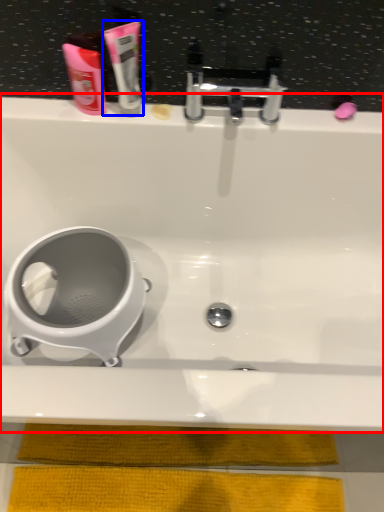
Question: Which of the following is the closest to the observer, bathtub (highlighted by a red box) or toothpaste (highlighted by a blue box)?

Choices:
 (A) bathtub
 (B) toothpaste

Answer: (A)